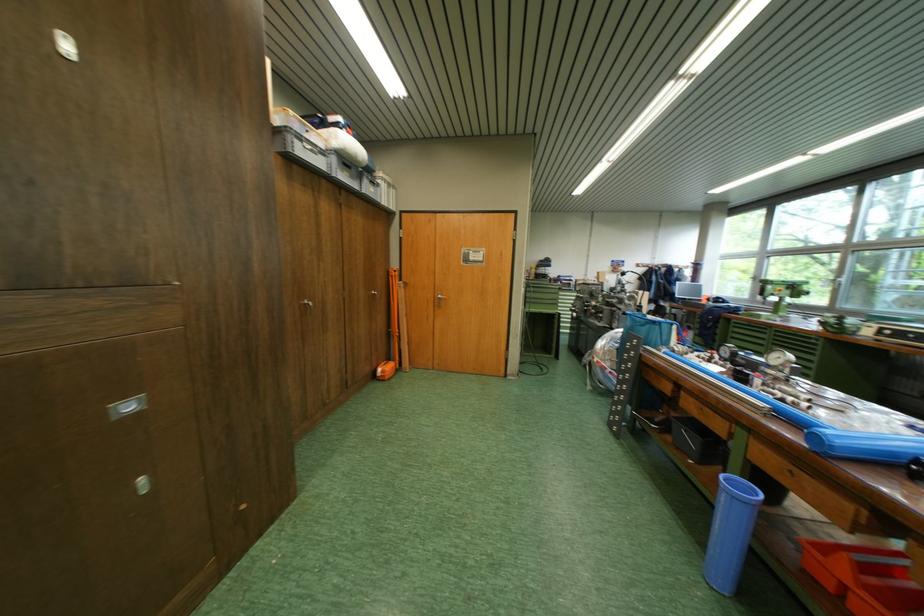
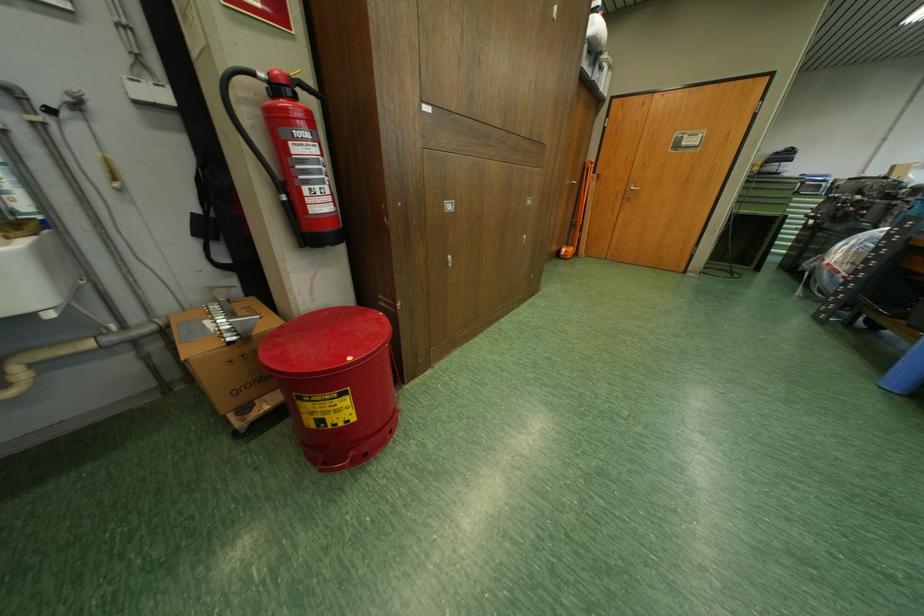
Locate, in the second image, the point that corresponds to (x=446, y=297) in the first image.

(638, 188)